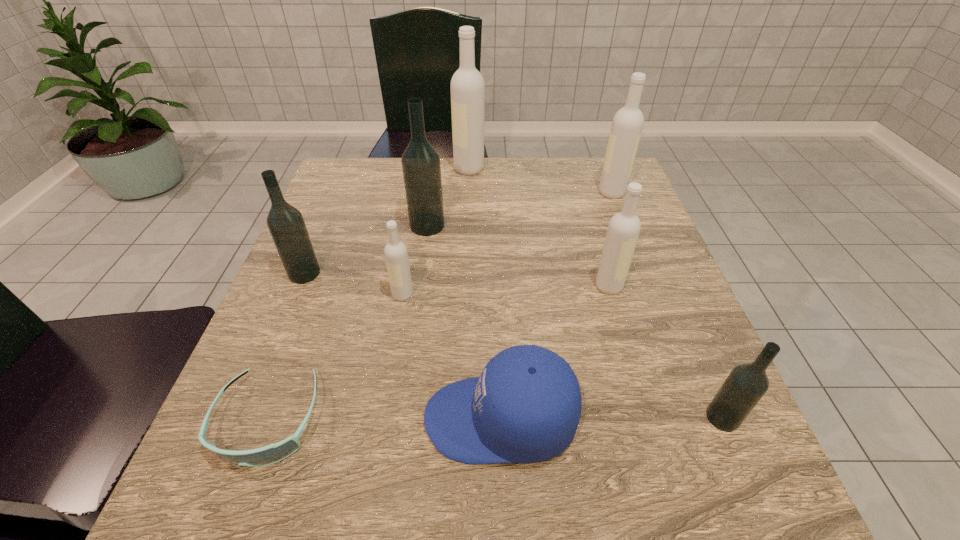
Identify the location of free space located on the back of the second farthest black vodka. (322, 231).

At what (x,y) coordinates should I click in order to perform the action: click on free space located on the right of the leftmost white vodka. Please return your answer as a coordinate pair (x, y). Looking at the image, I should click on (518, 295).

Identify the location of free space located on the back of the smallest black vodka. (673, 303).

The width and height of the screenshot is (960, 540). I want to click on vacant space positioned 0.290m on the front-facing side of the cap, so click(240, 419).

The height and width of the screenshot is (540, 960). In order to click on vacant space located on the front-facing side of the cap in this screenshot , I will do `click(335, 419)`.

Identify the location of vacant space located on the front-facing side of the cap. (227, 419).

Locate an element on the screen. Image resolution: width=960 pixels, height=540 pixels. cap that is positioned at the near edge is located at coordinates (525, 407).

The height and width of the screenshot is (540, 960). Find the location of `goggles at the near edge`. goggles at the near edge is located at coordinates (273, 453).

You are a GUI agent. You are given a task and a screenshot of the screen. Output one action in this format:
    pyautogui.click(x=<x>, y=<y>)
    Task: Click on the vodka present at the left edge
    This screenshot has height=540, width=960.
    Given the screenshot: What is the action you would take?
    pyautogui.click(x=286, y=224)

Identify the location of goggles that is at the left edge. (273, 453).